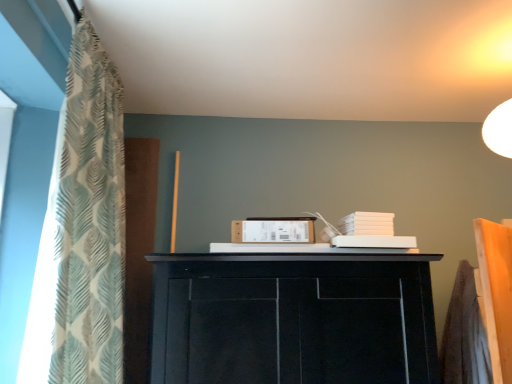
At what (x,y) coordinates should I click in order to perform the action: click on vacant space situated above patterned fabric curtain at left (from a real-world perspective). Please return your answer as a coordinate pair (x, y). The image size is (512, 384). Looking at the image, I should click on 120,53.